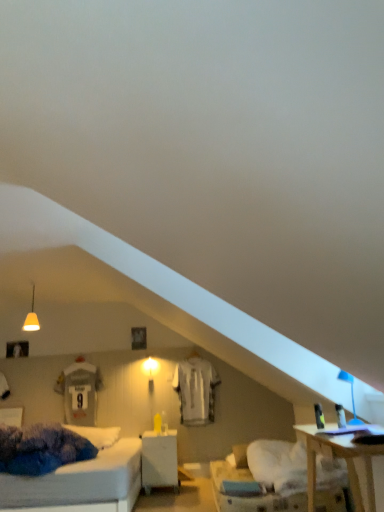
Question: Is blue plastic table lamp at upper right taller than white jersey at center?

Choices:
 (A) yes
 (B) no

Answer: (B)

Question: Could you tell me if blue plastic table lamp at upper right is turned towards white jersey at center?

Choices:
 (A) yes
 (B) no

Answer: (B)

Question: Is blue plastic table lamp at upper right completely or partially outside of white jersey at center?

Choices:
 (A) no
 (B) yes

Answer: (B)

Question: Does blue plastic table lamp at upper right come behind white jersey at center?

Choices:
 (A) no
 (B) yes

Answer: (A)

Question: Can you confirm if blue plastic table lamp at upper right is positioned to the right of white jersey at center?

Choices:
 (A) no
 (B) yes

Answer: (B)

Question: From the image's perspective, would you say blue plastic table lamp at upper right is positioned over white jersey at center?

Choices:
 (A) yes
 (B) no

Answer: (A)

Question: Could you tell me if white fabric pillow at lower center is facing blue plastic table lamp at upper right?

Choices:
 (A) no
 (B) yes

Answer: (B)

Question: Is white fabric pillow at lower center thinner than blue plastic table lamp at upper right?

Choices:
 (A) yes
 (B) no

Answer: (B)

Question: From the image's perspective, is white fabric pillow at lower center on blue plastic table lamp at upper right?

Choices:
 (A) no
 (B) yes

Answer: (A)

Question: Would you say blue plastic table lamp at upper right is part of white fabric pillow at lower center's contents?

Choices:
 (A) no
 (B) yes

Answer: (A)

Question: Does white fabric pillow at lower center appear on the left side of blue plastic table lamp at upper right?

Choices:
 (A) yes
 (B) no

Answer: (A)

Question: Is white fabric pillow at lower center shorter than blue plastic table lamp at upper right?

Choices:
 (A) no
 (B) yes

Answer: (B)

Question: Is white jersey at center a part of matte white pendant light at upper left?

Choices:
 (A) no
 (B) yes

Answer: (A)